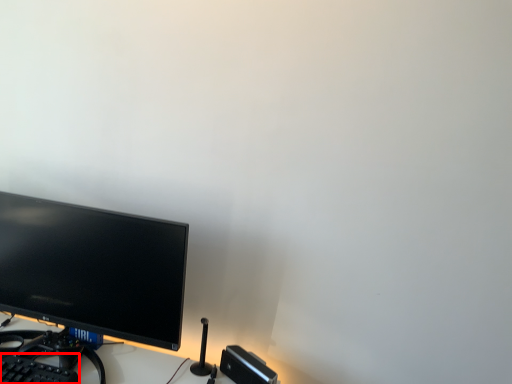
Question: From the image's perspective, what is the correct spatial relationship of computer keyboard (annotated by the red box) in relation to computer monitor?

Choices:
 (A) below
 (B) above

Answer: (A)